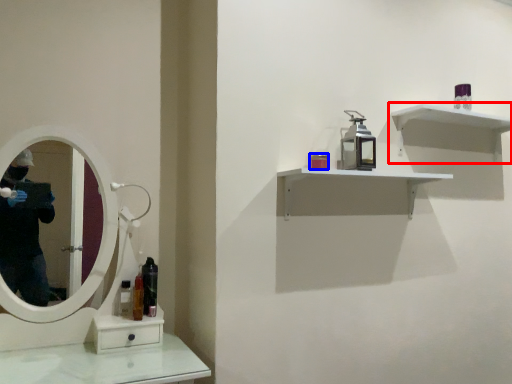
Question: Which object is closer to the camera taking this photo, shelf (highlighted by a red box) or toiletry (highlighted by a blue box)?

Choices:
 (A) shelf
 (B) toiletry

Answer: (B)